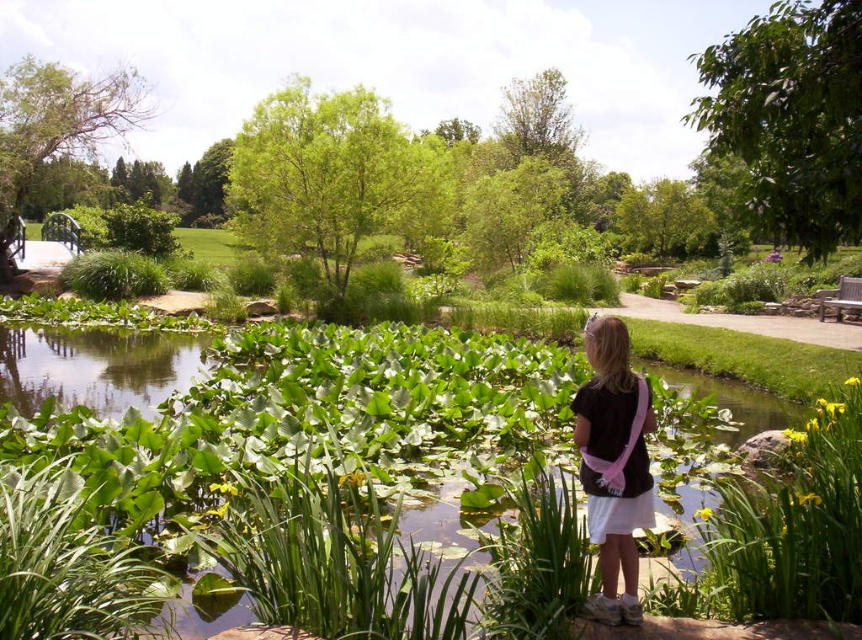
What is the exact coordinate of the green leafy water at center?

The green leafy water at center is located at point [291,406].

You are standing at the point where the girl is facing the pond. The green leafy water is represented by the point at coordinates (291,406). If you want to walk directly towards the green leafy water, which direction should you move from your current position?

Since the green leafy water is at the center represented by point (291,406), you should move forward towards the center of the pond where the girl is facing.